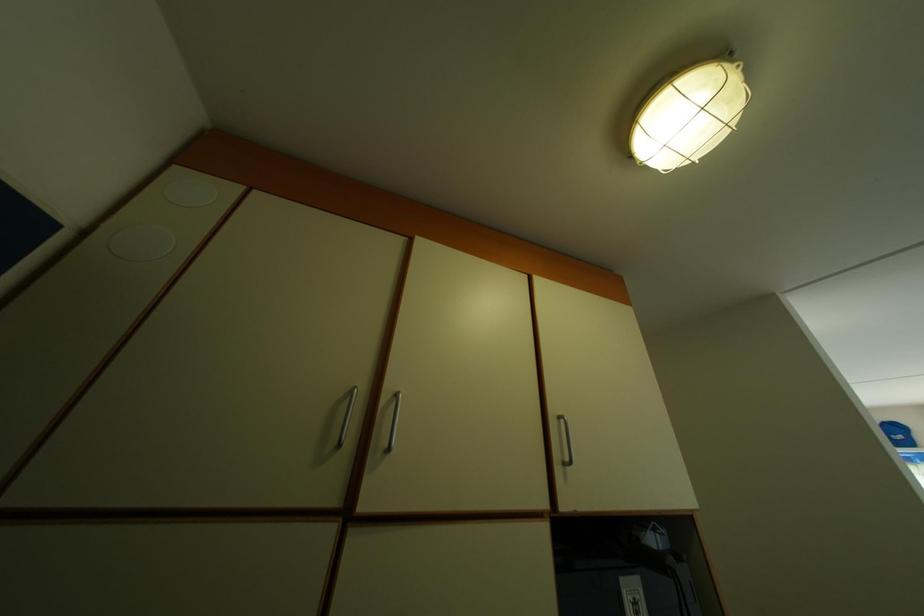
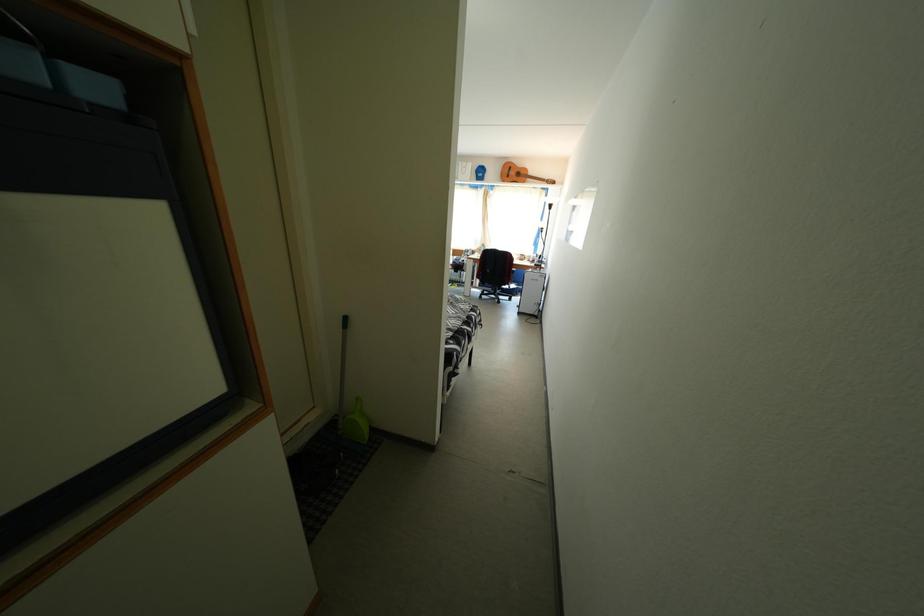
The first image is from the beginning of the video and the second image is from the end. How did the camera likely rotate when shooting the video?

The rotation direction of the camera is right-down.